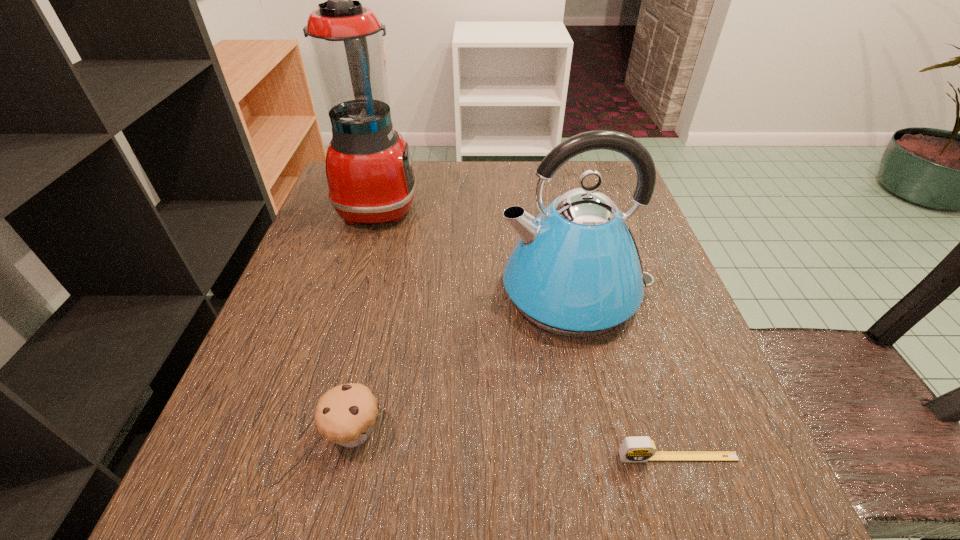
Find the location of a particular element. The height and width of the screenshot is (540, 960). blank space located 0.340m on the back of the third tallest object is located at coordinates (394, 255).

Identify the location of free region located at the front of the shortest object with the tape extended. Image resolution: width=960 pixels, height=540 pixels. (696, 512).

This screenshot has width=960, height=540. What are the coordinates of `object positioned at the far edge` in the screenshot? It's located at (369, 172).

Image resolution: width=960 pixels, height=540 pixels. I want to click on muffin positioned at the near edge, so point(345,414).

I want to click on tape measure that is positioned at the near edge, so click(640, 448).

At what (x,y) coordinates should I click in order to perform the action: click on food processor that is at the left edge. Please return your answer as a coordinate pair (x, y). This screenshot has width=960, height=540. Looking at the image, I should click on point(369,172).

I want to click on muffin present at the left edge, so click(345, 414).

You are a GUI agent. You are given a task and a screenshot of the screen. Output one action in this format:
    pyautogui.click(x=<x>, y=<y>)
    Task: Click on the kettle that is at the right edge
    
    Given the screenshot: What is the action you would take?
    576,271

Find the location of a particular element. tape measure that is positioned at the right edge is located at coordinates (640, 448).

Locate an element on the screen. The width and height of the screenshot is (960, 540). object that is at the far left corner is located at coordinates (369, 172).